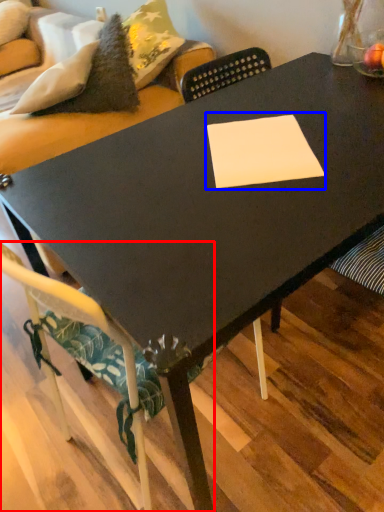
Question: Which of the following is the closest to the observer, chair (highlighted by a red box) or rectangle (highlighted by a blue box)?

Choices:
 (A) chair
 (B) rectangle

Answer: (A)